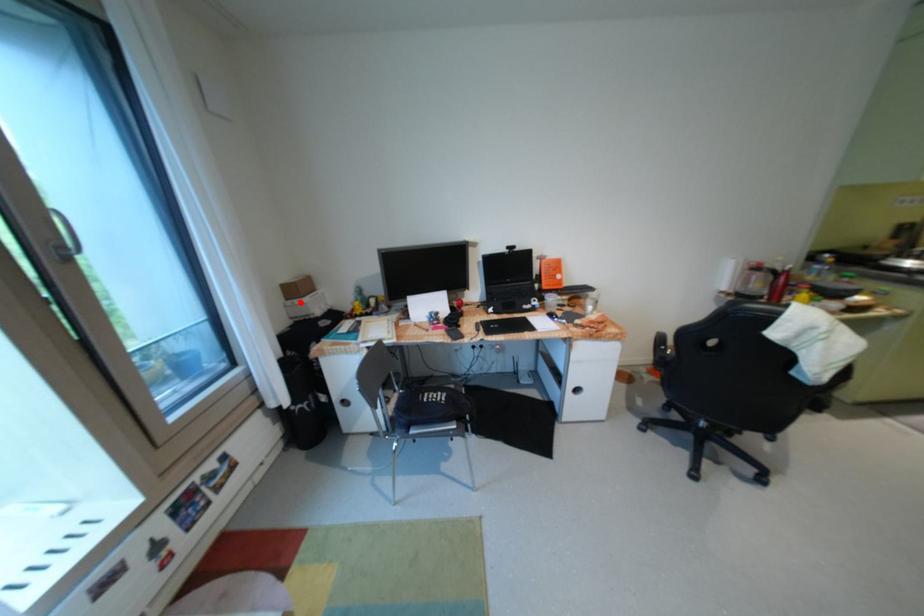
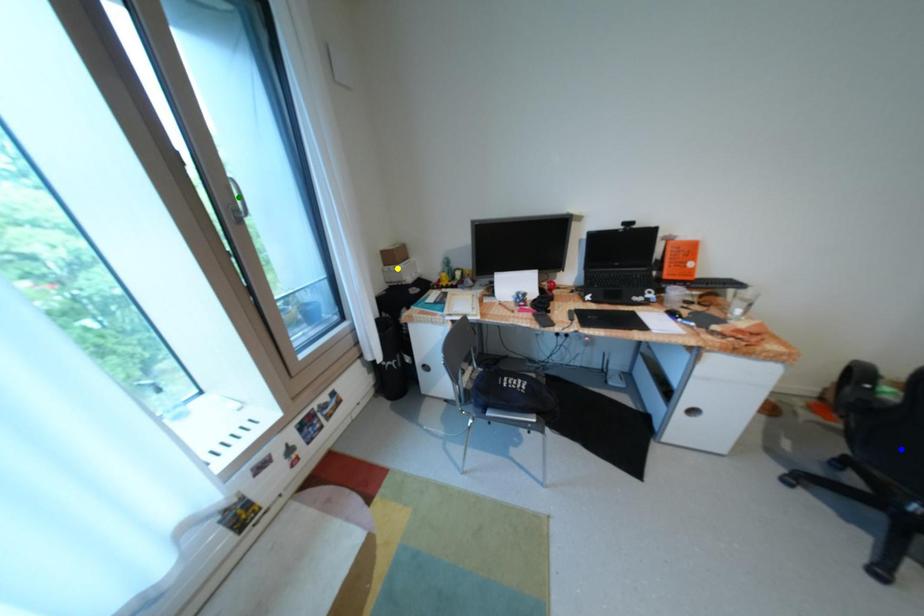
Question: I am providing you with two images of the same scene from different viewpoints. A red point is marked on the first image. You are given multiple points on the second image. Which spot in image 2 lines up with the point in image 1?

Choices:
 (A) green point
 (B) yellow point
 (C) blue point

Answer: (B)